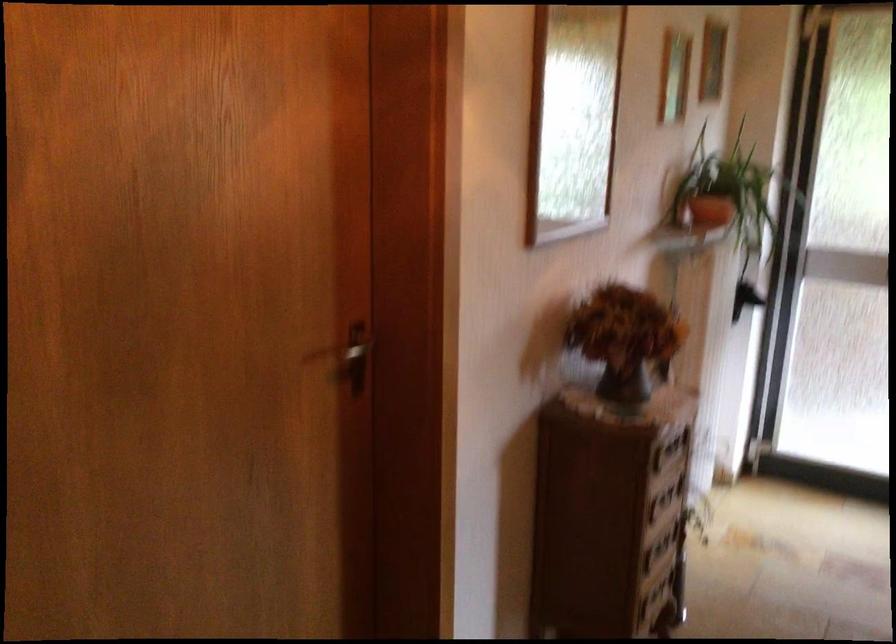
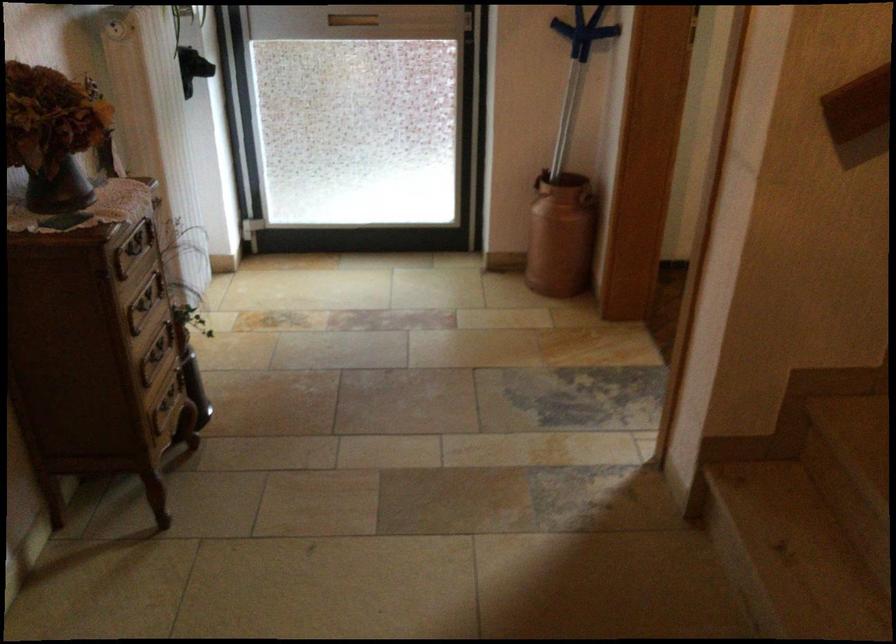
Locate, in the second image, the point that corresponds to point 670,448 in the first image.

(133, 248)